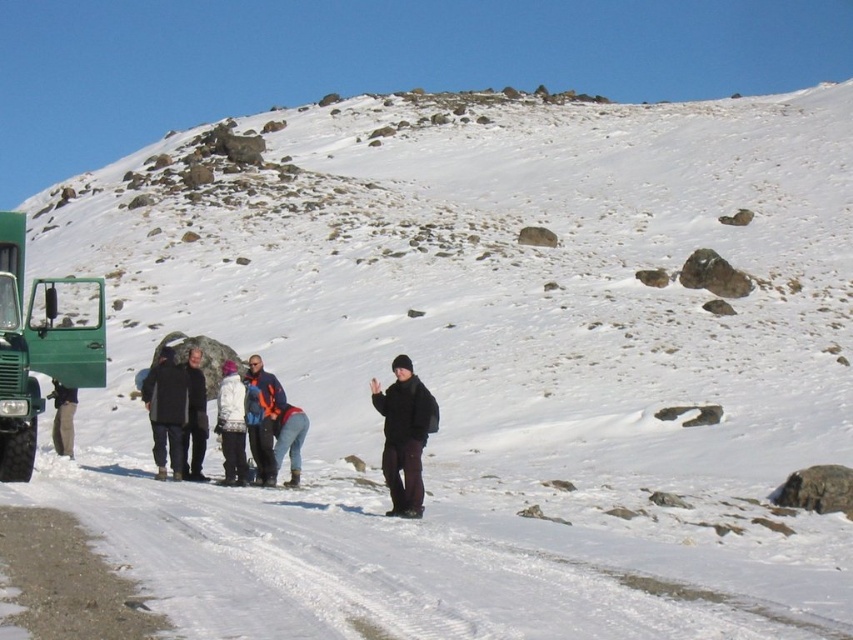
You are a hiker who needs to reach the green matte truck at left from your current position. The path is covered in snow and has scattered rocks. Considering the distance, would you estimate the journey to take more than 3 minutes?

The distance between the green matte truck at left and the camera is 21.43 meters. At an average walking speed of 1.4 meters per second, it would take approximately 15.3 seconds, so the journey would take less than 3 minutes.

You are planning to take a photo of the orange reflective jacket at center and dark gray pants at center. Which object is narrower?

The orange reflective jacket at center is narrower than the dark gray pants at center.